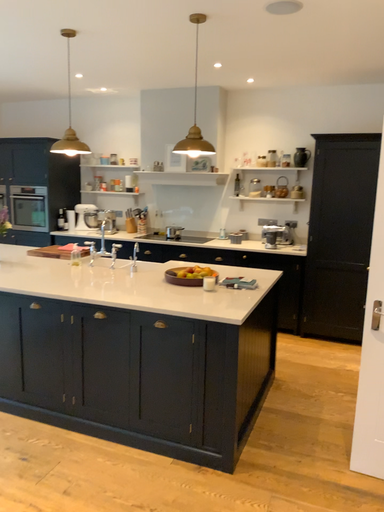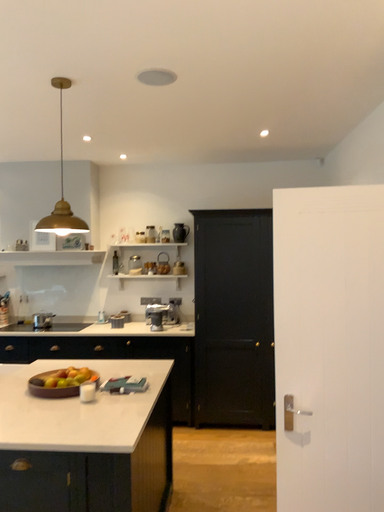
Question: How did the camera likely rotate when shooting the video?

Choices:
 (A) rotated downward
 (B) rotated upward

Answer: (B)